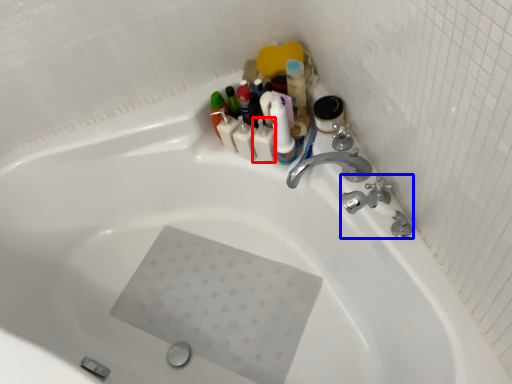
Question: Which of the following is the farthest to the observer, toiletry (highlighted by a red box) or plumbing fixture (highlighted by a blue box)?

Choices:
 (A) toiletry
 (B) plumbing fixture

Answer: (A)